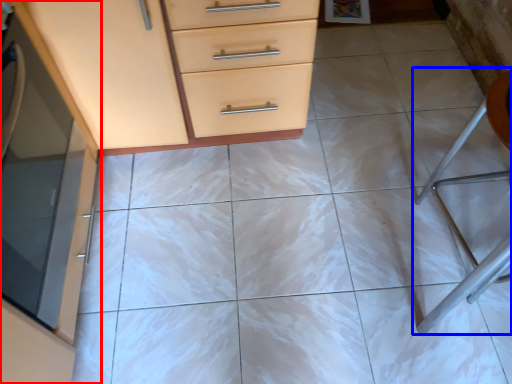
Question: Which of the following is the closest to the observer, cabinetry (highlighted by a red box) or folding chair (highlighted by a blue box)?

Choices:
 (A) cabinetry
 (B) folding chair

Answer: (A)